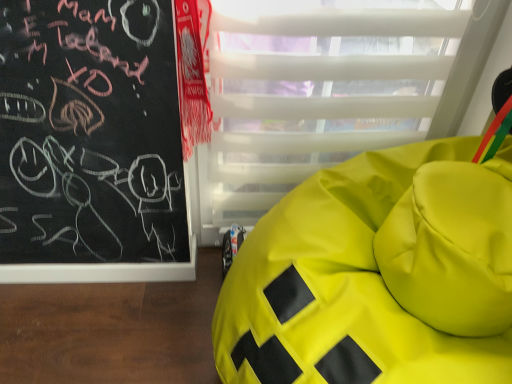
Question: From the image's perspective, is transparent plastic glass door at center below lime green fabric bean bag at right?

Choices:
 (A) no
 (B) yes

Answer: (A)

Question: Does transparent plastic glass door at center have a lesser width compared to lime green fabric bean bag at right?

Choices:
 (A) yes
 (B) no

Answer: (A)

Question: Can you confirm if transparent plastic glass door at center is positioned to the right of lime green fabric bean bag at right?

Choices:
 (A) yes
 (B) no

Answer: (B)

Question: Is the surface of transparent plastic glass door at center in direct contact with lime green fabric bean bag at right?

Choices:
 (A) yes
 (B) no

Answer: (B)

Question: Considering the relative sizes of transparent plastic glass door at center and lime green fabric bean bag at right in the image provided, is transparent plastic glass door at center shorter than lime green fabric bean bag at right?

Choices:
 (A) no
 (B) yes

Answer: (A)

Question: Considering the relative positions of transparent plastic glass door at center and lime green fabric bean bag at right in the image provided, is transparent plastic glass door at center behind lime green fabric bean bag at right?

Choices:
 (A) no
 (B) yes

Answer: (B)

Question: Is transparent plastic glass door at center completely or partially inside lime green fabric bean bag at right?

Choices:
 (A) yes
 (B) no

Answer: (B)

Question: Does lime green fabric bean bag at right have a lesser width compared to transparent plastic glass door at center?

Choices:
 (A) yes
 (B) no

Answer: (B)

Question: From a real-world perspective, is lime green fabric bean bag at right over transparent plastic glass door at center?

Choices:
 (A) no
 (B) yes

Answer: (A)

Question: From a real-world perspective, is lime green fabric bean bag at right positioned under transparent plastic glass door at center based on gravity?

Choices:
 (A) yes
 (B) no

Answer: (A)

Question: Considering the relative positions of lime green fabric bean bag at right and transparent plastic glass door at center in the image provided, is lime green fabric bean bag at right to the right of transparent plastic glass door at center from the viewer's perspective?

Choices:
 (A) yes
 (B) no

Answer: (A)

Question: Is lime green fabric bean bag at right located outside transparent plastic glass door at center?

Choices:
 (A) no
 (B) yes

Answer: (B)

Question: In terms of size, does transparent plastic glass door at center appear bigger or smaller than lime green fabric bean bag at right?

Choices:
 (A) small
 (B) big

Answer: (A)